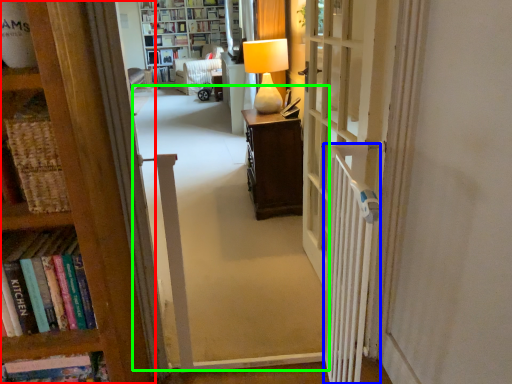
Question: Considering the real-world distances, which object is closest to bookcase (highlighted by a red box)? radiator (highlighted by a blue box) or corridor (highlighted by a green box).

Choices:
 (A) radiator
 (B) corridor

Answer: (A)